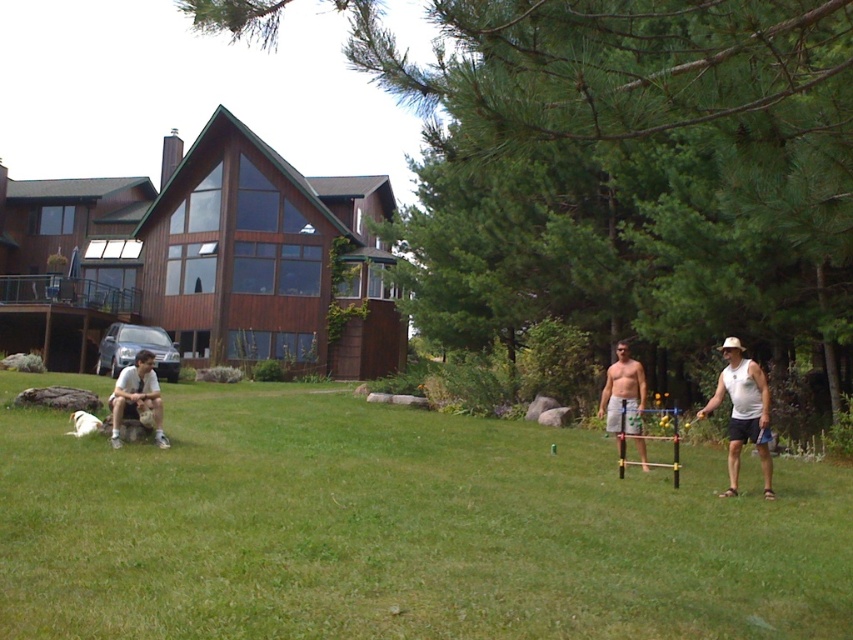
You are standing at the point labeled point [747,420] and want to walk towards the house. Will you pass by the point labeled point [640,449] before reaching the house?

Yes, because point [747,420] is in front of point [640,449], so walking towards the house from point [747,420] would require passing point [640,449] first.

You are organizing a picnic and need to decide which item can hold more snacks between the white plastic bag at right and the shiny silver shorts at center. Which one should you choose?

The white plastic bag at right is bigger than the shiny silver shorts at center, so you should choose the white plastic bag at right to hold more snacks.